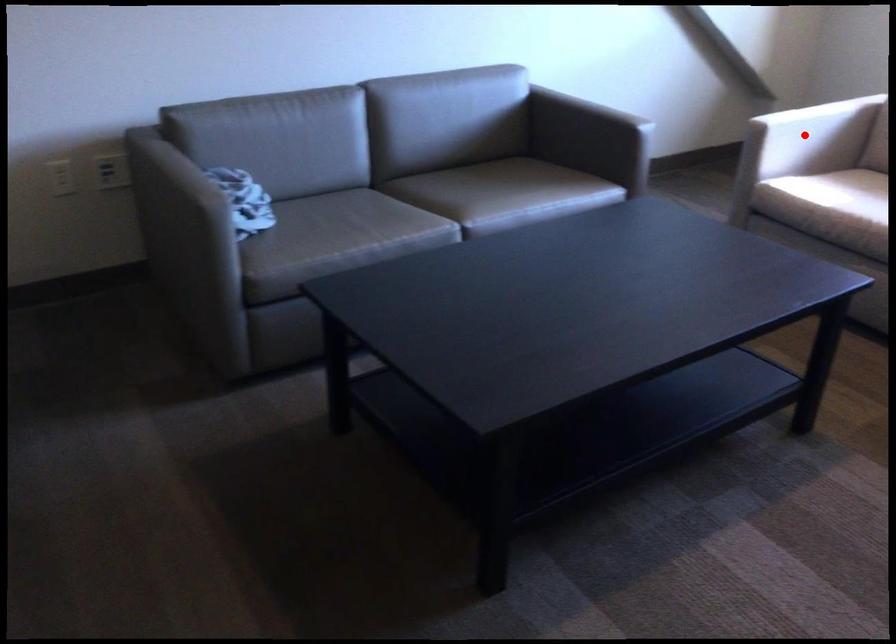
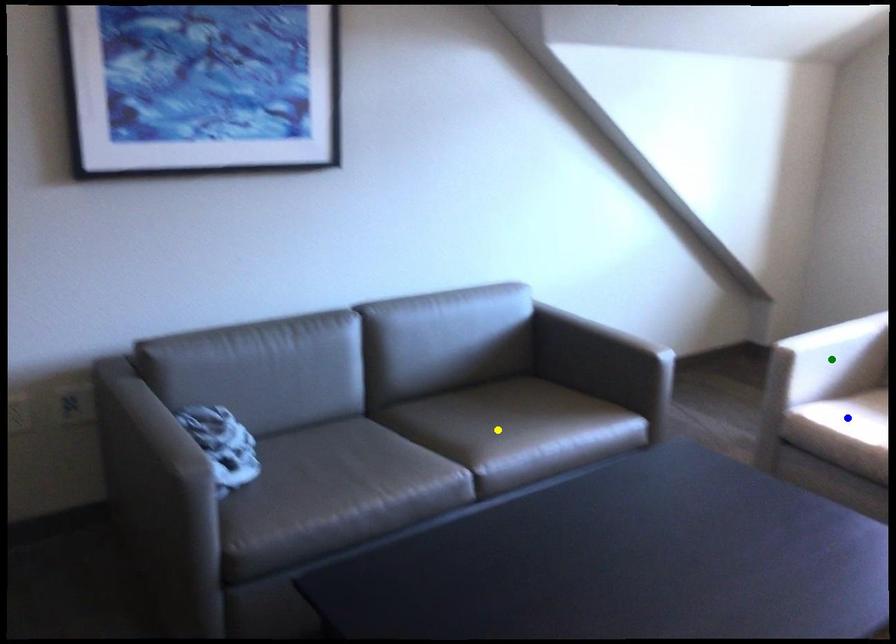
Question: I am providing you with two images of the same scene from different viewpoints. A red point is marked on the first image. You are given multiple points on the second image. In image 2, which mark is for the same physical point as the one in image 1?

Choices:
 (A) green point
 (B) yellow point
 (C) blue point

Answer: (A)